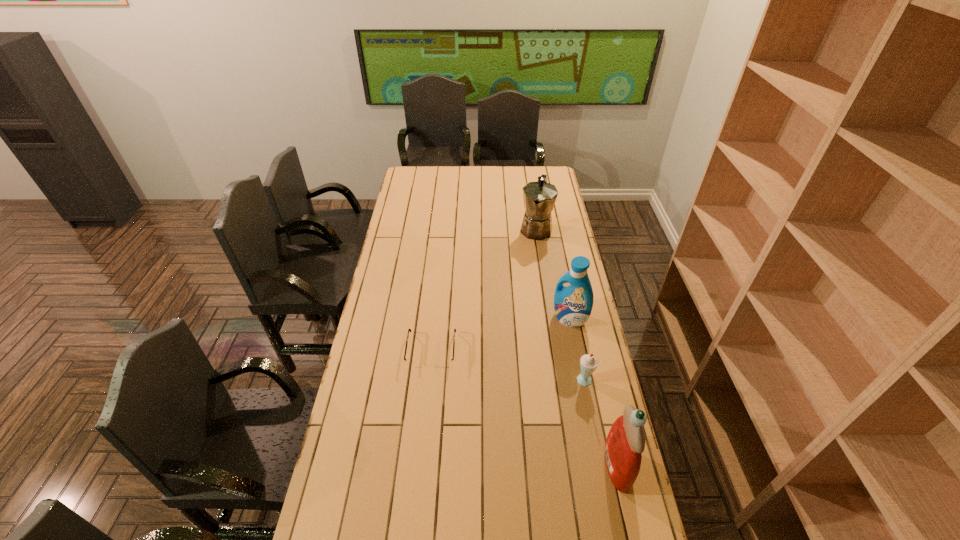
Where is `the third nearest object`? This screenshot has height=540, width=960. the third nearest object is located at coordinates (411, 363).

Image resolution: width=960 pixels, height=540 pixels. Find the location of `the leftmost object`. the leftmost object is located at coordinates (411, 363).

This screenshot has width=960, height=540. I want to click on the nearest object, so click(x=625, y=442).

The height and width of the screenshot is (540, 960). I want to click on the second farthest object, so [x=573, y=304].

Identify the location of the fourth farthest object. This screenshot has width=960, height=540. (588, 363).

This screenshot has height=540, width=960. Find the location of `milkshake`. milkshake is located at coordinates (588, 363).

Where is `the farthest object`? the farthest object is located at coordinates (539, 197).

The width and height of the screenshot is (960, 540). I want to click on vacant space situated 0.310m at the hinge ends of the third nearest object, so click(421, 454).

Find the location of a particular element. This screenshot has height=540, width=960. vacant space located 0.340m on the front-facing side of the second farthest object is located at coordinates (512, 385).

What are the coordinates of `blank area located on the front-facing side of the second farthest object` in the screenshot? It's located at (541, 349).